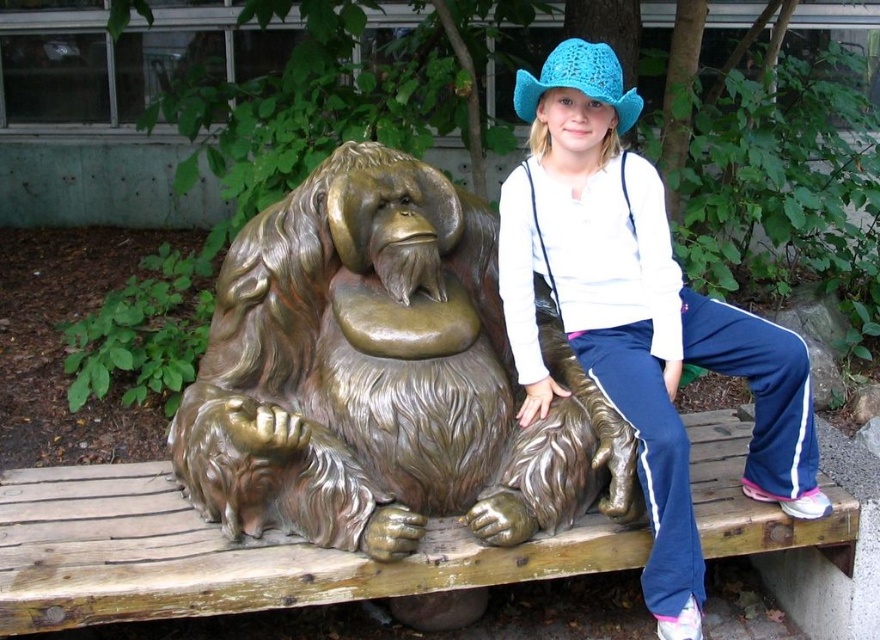
Question: Which object appears closest to the camera in this image?

Choices:
 (A) crochet blue hat at upper right
 (B) bronze statue at center

Answer: (B)

Question: Which of the following is the farthest from the observer?

Choices:
 (A) crochet blue hat at upper right
 (B) bronze statue at center
 (C) blue knitted hat at upper right

Answer: (A)

Question: Can you confirm if bronze statue at center is positioned above blue knitted hat at upper right?

Choices:
 (A) yes
 (B) no

Answer: (B)

Question: Is bronze statue at center to the left of blue knitted hat at upper right from the viewer's perspective?

Choices:
 (A) yes
 (B) no

Answer: (A)

Question: Which object appears closest to the camera in this image?

Choices:
 (A) bronze statue at center
 (B) crochet blue hat at upper right

Answer: (A)

Question: Does blue knitted hat at upper right appear under crochet blue hat at upper right?

Choices:
 (A) yes
 (B) no

Answer: (A)